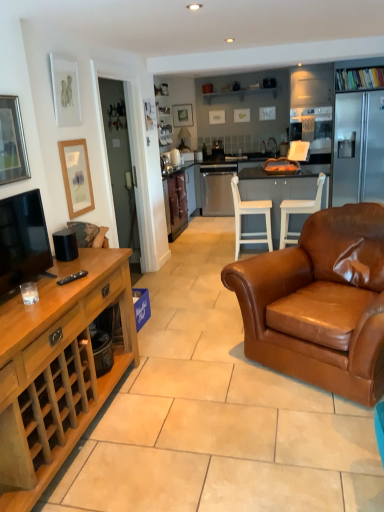
Question: Considering the relative positions of brown leather armchair at center and matte wooden picture frame at left, which is the second picture frame from back to front, in the image provided, is brown leather armchair at center to the right of matte wooden picture frame at left, which is the second picture frame from back to front, from the viewer's perspective?

Choices:
 (A) no
 (B) yes

Answer: (B)

Question: Is brown leather armchair at center positioned before matte wooden picture frame at left, acting as the 3th picture frame starting from the front?

Choices:
 (A) no
 (B) yes

Answer: (B)

Question: Does brown leather armchair at center have a greater width compared to matte wooden picture frame at left, which is the second picture frame in right-to-left order?

Choices:
 (A) no
 (B) yes

Answer: (B)

Question: From the image's perspective, is brown leather armchair at center over matte wooden picture frame at left, which is the second picture frame from back to front?

Choices:
 (A) no
 (B) yes

Answer: (A)

Question: Does brown leather armchair at center have a greater height compared to matte wooden picture frame at left, positioned as the fourth picture frame in top-to-bottom order?

Choices:
 (A) no
 (B) yes

Answer: (B)

Question: Is brown leather armchair at center smaller than matte wooden picture frame at left, which is the second picture frame from back to front?

Choices:
 (A) no
 (B) yes

Answer: (A)

Question: Considering the relative sizes of silver-framed picture at upper left, the first picture frame viewed from the front, and brown leather armchair at center in the image provided, is silver-framed picture at upper left, the first picture frame viewed from the front, thinner than brown leather armchair at center?

Choices:
 (A) yes
 (B) no

Answer: (A)

Question: Is silver-framed picture at upper left, positioned as the fourth picture frame in back-to-front order, completely or partially outside of brown leather armchair at center?

Choices:
 (A) no
 (B) yes

Answer: (B)

Question: Considering the relative sizes of silver-framed picture at upper left, positioned as the fourth picture frame in back-to-front order, and brown leather armchair at center in the image provided, is silver-framed picture at upper left, positioned as the fourth picture frame in back-to-front order, shorter than brown leather armchair at center?

Choices:
 (A) no
 (B) yes

Answer: (B)

Question: Is the surface of silver-framed picture at upper left, the first picture frame viewed from the front, in direct contact with brown leather armchair at center?

Choices:
 (A) no
 (B) yes

Answer: (A)

Question: From the image's perspective, is silver-framed picture at upper left, the first picture frame viewed from the front, below brown leather armchair at center?

Choices:
 (A) yes
 (B) no

Answer: (B)

Question: From the image's perspective, is silver-framed picture at upper left, positioned as the fourth picture frame in back-to-front order, over brown leather armchair at center?

Choices:
 (A) yes
 (B) no

Answer: (A)

Question: From a real-world perspective, is matte black picture frame at upper center, the 1th picture frame viewed from the back, positioned over wooden cabinet at left, which ranks as the 2th cabinetry in top-to-bottom order, based on gravity?

Choices:
 (A) no
 (B) yes

Answer: (B)